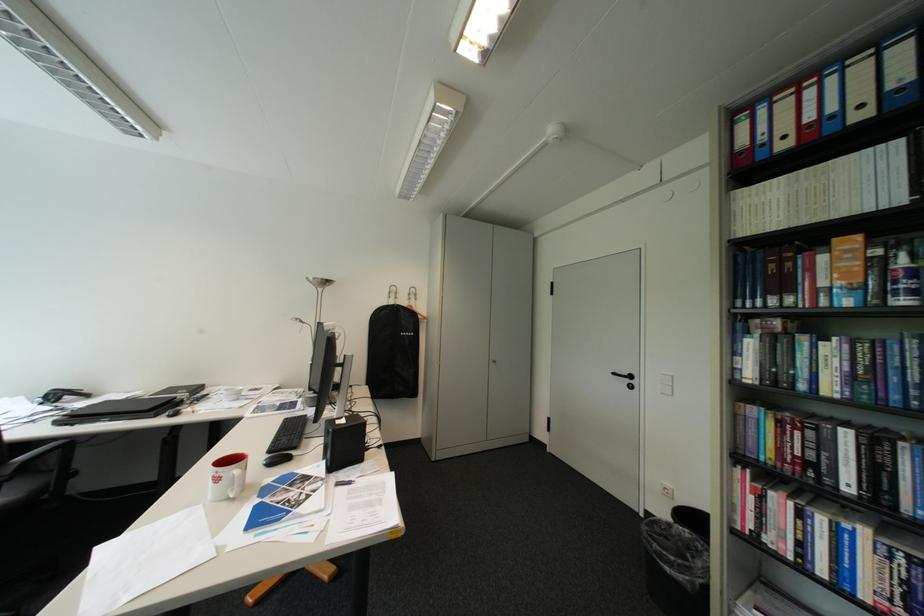
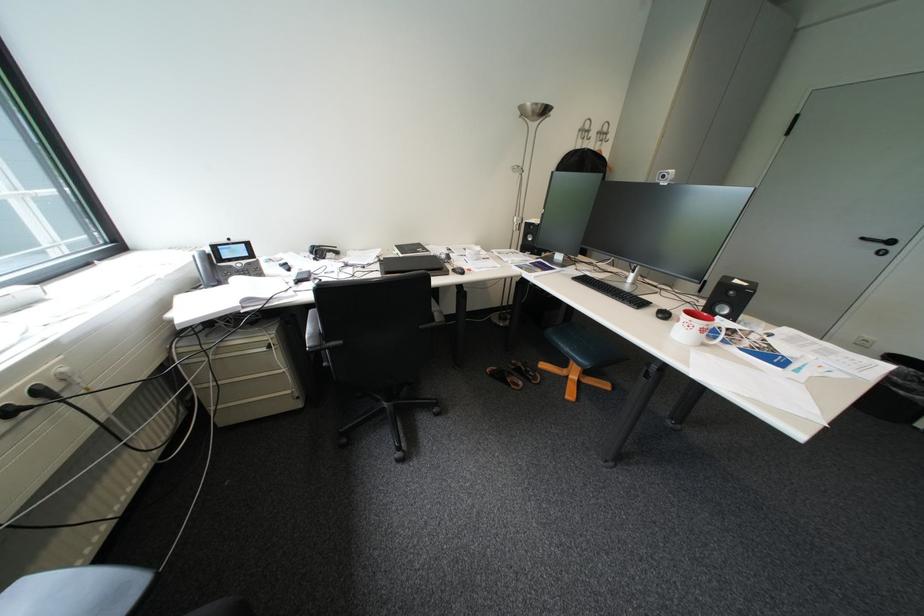
Find the pixel in the second image that matches point (67, 397) in the first image.

(331, 253)